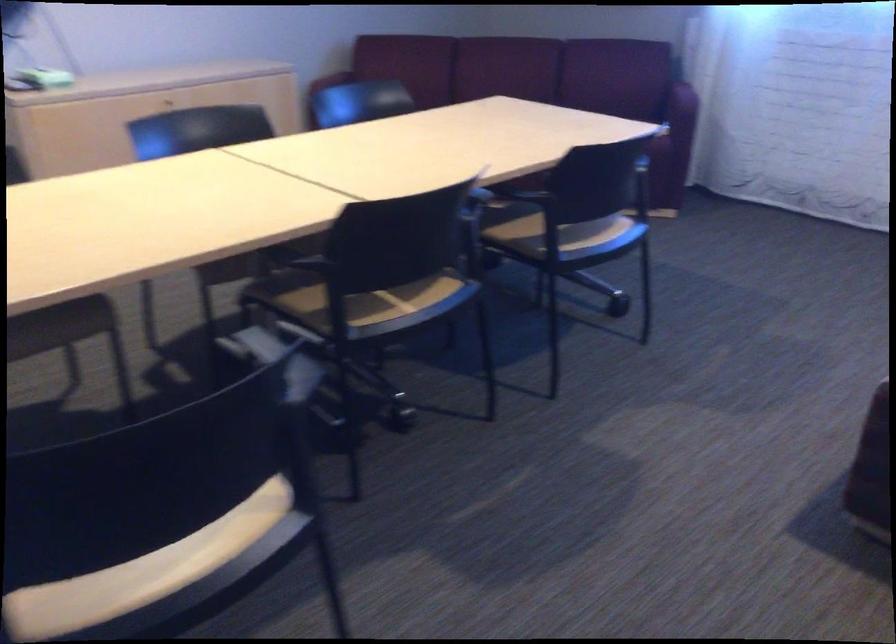
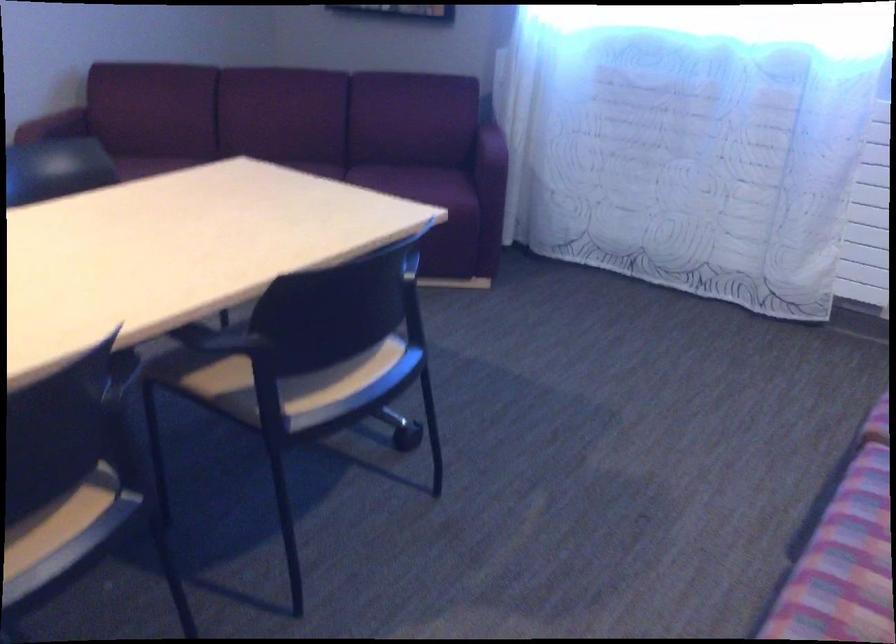
In a continuous first-person perspective shot, in which direction is the camera moving?

The movement direction of the cameraman is right, forward.